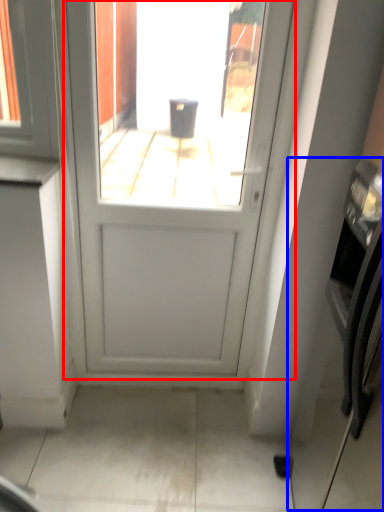
Question: Which object is further to the camera taking this photo, door (highlighted by a red box) or oven (highlighted by a blue box)?

Choices:
 (A) door
 (B) oven

Answer: (A)